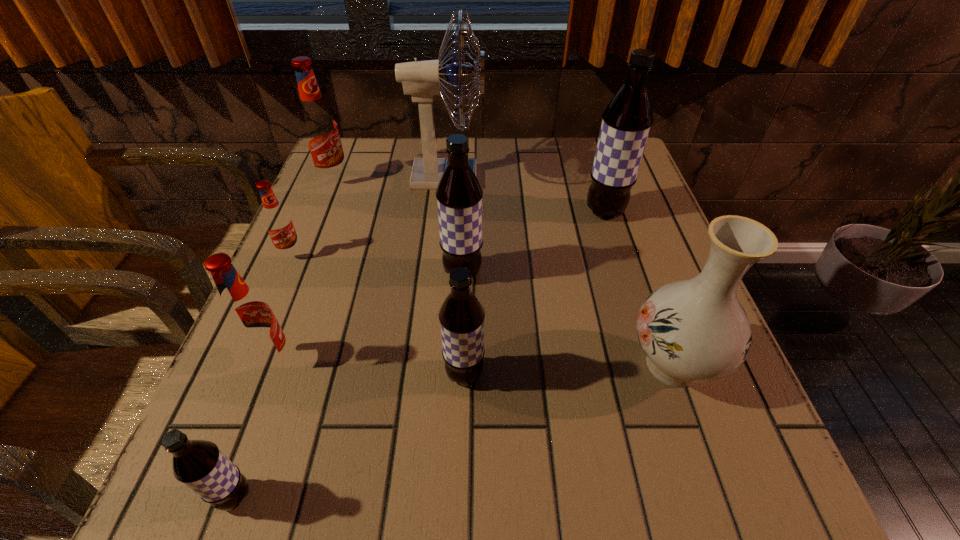
Find the location of a particular element. blue fan is located at coordinates (422, 80).

Identify the location of the farthest brown root beer. (626, 122).

Identify the location of the tallest root beer. (626, 122).

Where is `the farthest red root beer`? the farthest red root beer is located at coordinates (319, 128).

The height and width of the screenshot is (540, 960). In order to click on the biggest red root beer in this screenshot , I will do `click(319, 128)`.

This screenshot has height=540, width=960. In order to click on the second farthest brown root beer in this screenshot , I will do coord(459,194).

At what (x,y) coordinates should I click in order to perform the action: click on vase. Please return your answer as a coordinate pair (x, y). This screenshot has height=540, width=960. Looking at the image, I should click on (695, 330).

Where is `the second smallest red root beer`? Image resolution: width=960 pixels, height=540 pixels. the second smallest red root beer is located at coordinates (249, 318).

The width and height of the screenshot is (960, 540). What are the coordinates of `the second nearest brown root beer` in the screenshot? It's located at (461, 316).

The image size is (960, 540). In order to click on the smallest red root beer in this screenshot , I will do `click(278, 222)`.